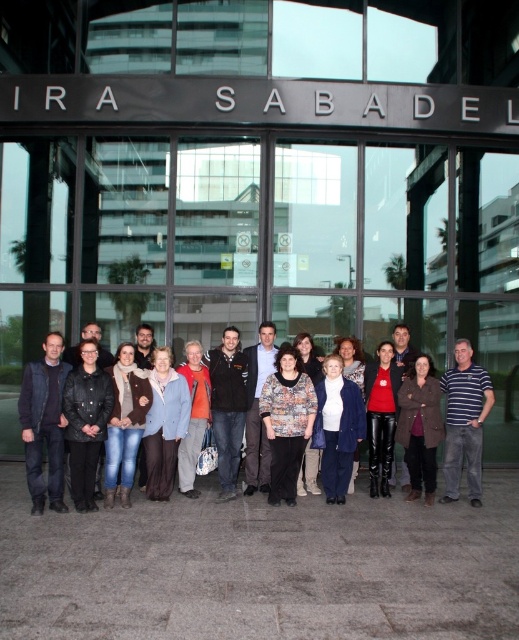
Is dark blue sweater at left taller than striped polo shirt at right?

In fact, dark blue sweater at left may be shorter than striped polo shirt at right.

Is point (57, 353) less distant than point (463, 410)?

Yes, it is.

Describe the element at coordinates (44, 422) in the screenshot. I see `dark blue sweater at left` at that location.

The height and width of the screenshot is (640, 519). I want to click on dark blue sweater at left, so click(44, 422).

Is light blue fabric coat at center taller than brown leather jacket at center?

Correct, light blue fabric coat at center is much taller as brown leather jacket at center.

Is light blue fabric coat at center to the right of brown leather jacket at center from the viewer's perspective?

In fact, light blue fabric coat at center is to the left of brown leather jacket at center.

Identify the location of light blue fabric coat at center. The image size is (519, 640). (165, 424).

Can you confirm if dark gray sweater at center is thinner than matte red sweater at center?

No, dark gray sweater at center is not thinner than matte red sweater at center.

Can you confirm if dark gray sweater at center is wider than matte red sweater at center?

Yes, dark gray sweater at center is wider than matte red sweater at center.

Locate an element on the screen. The width and height of the screenshot is (519, 640). dark gray sweater at center is located at coordinates (227, 406).

Locate an element on the screen. The width and height of the screenshot is (519, 640). dark gray sweater at center is located at coordinates (227, 406).